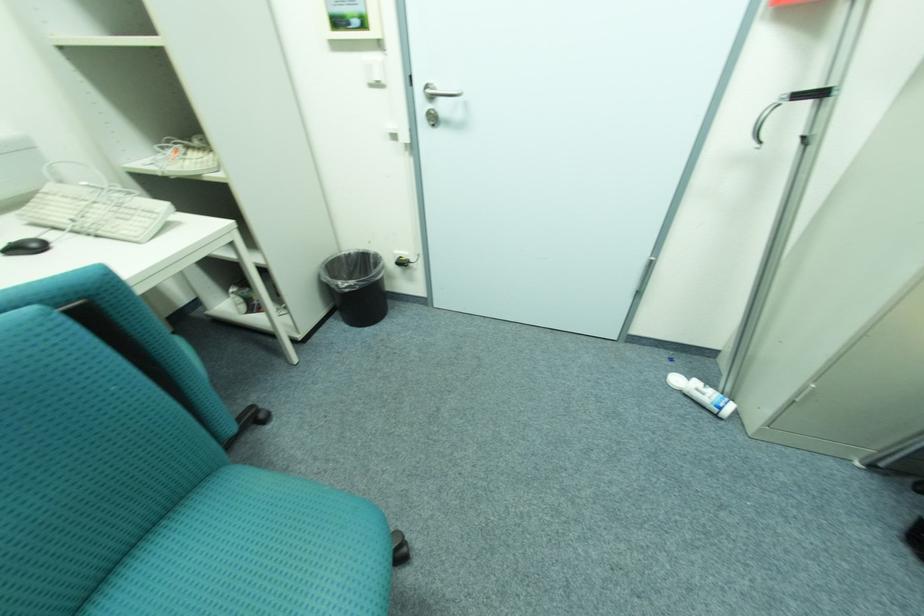
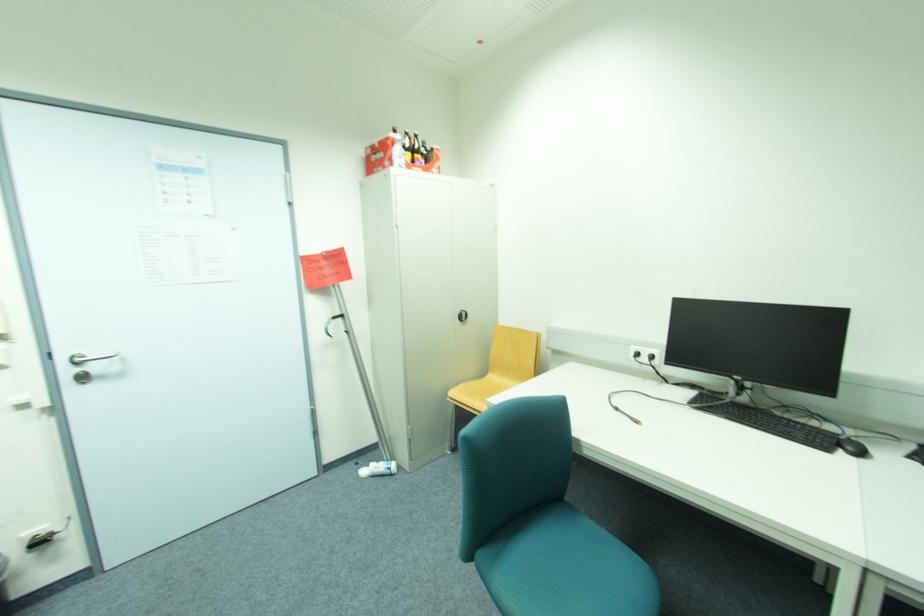
Find the pixel in the second image that matches [805,95] in the first image.

(339, 317)